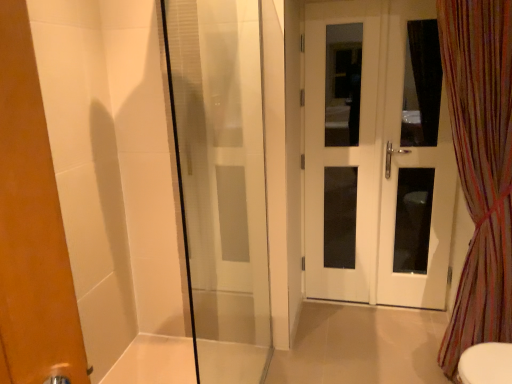
Where is `free space in front of white glass door at right, the 1th screen door positioned from the right`? The height and width of the screenshot is (384, 512). free space in front of white glass door at right, the 1th screen door positioned from the right is located at coordinates (411, 335).